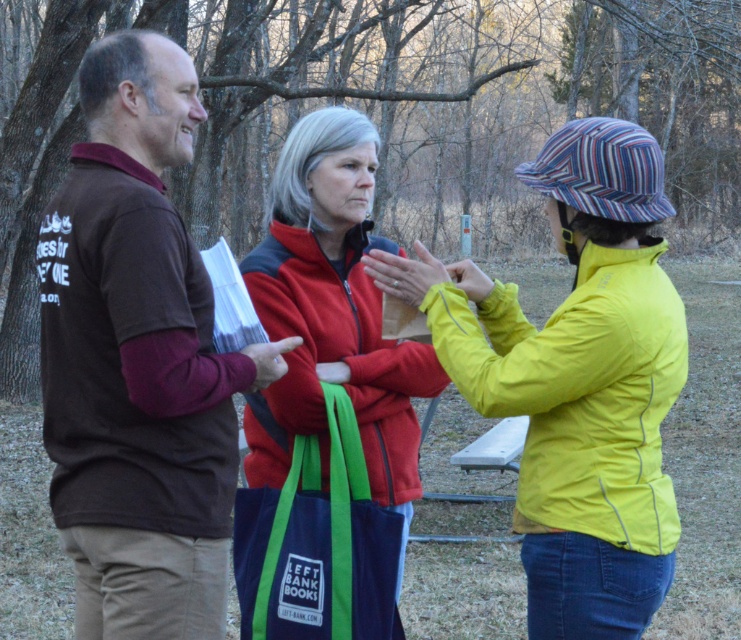
Which object is closer to the point marked at coordinates [139,360]?

The point marked at [139,360] is closer to the brown cotton shirt at left.